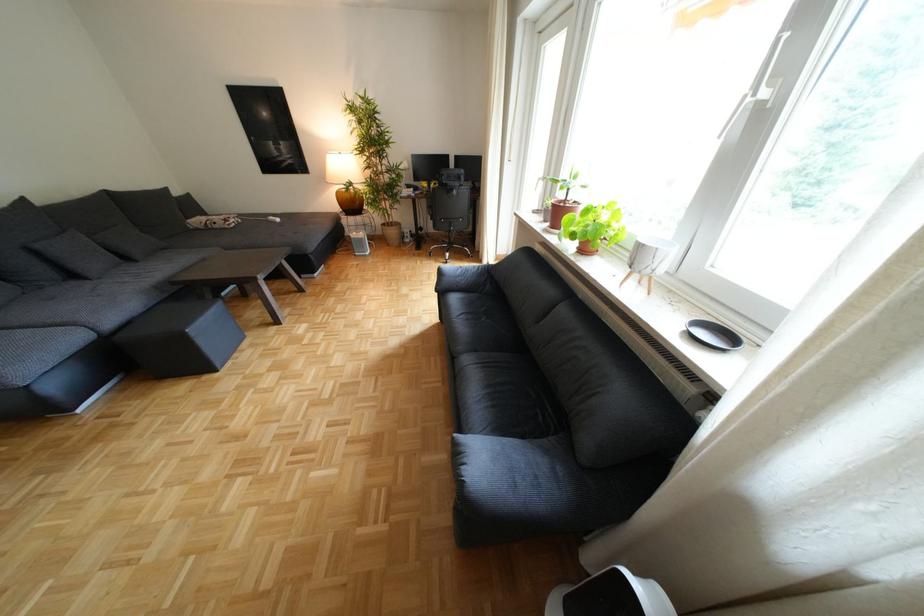
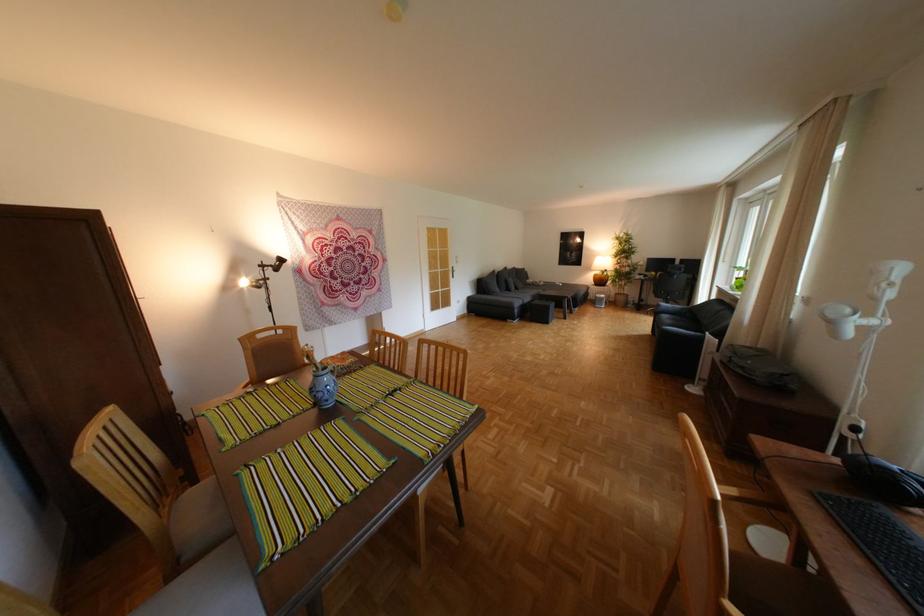
Where in the second image is the point corresponding to pixel 336 179 from the first image?

(602, 268)